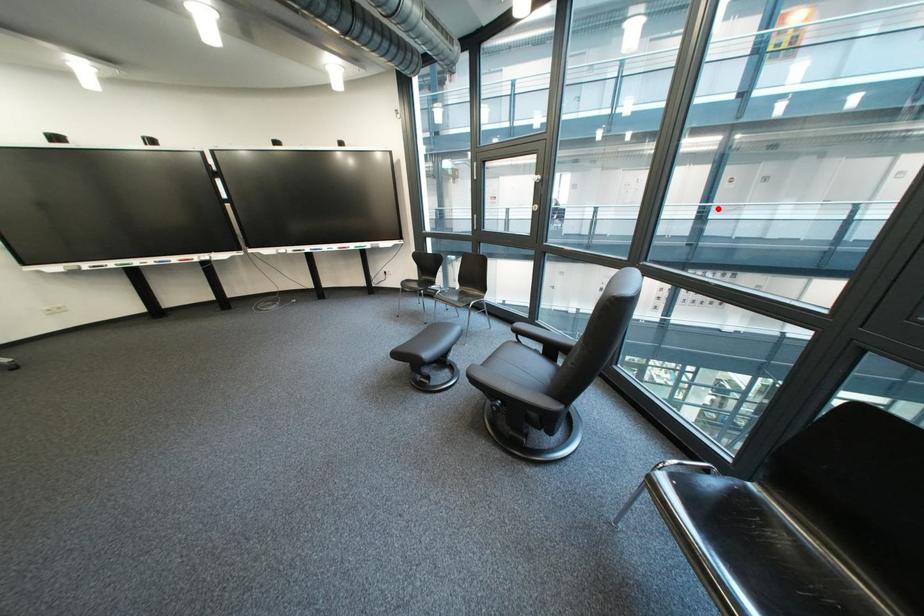
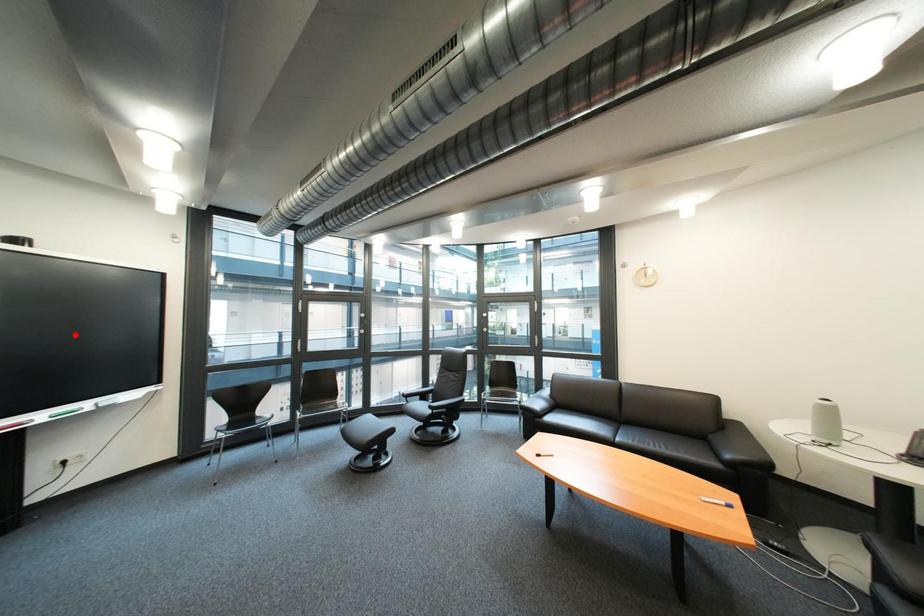
I am providing you with two images of the same scene from different viewpoints. A red point is marked on the first image and another point is marked on the second image. Is the marked point in image1 the same physical position as the marked point in image2?

No